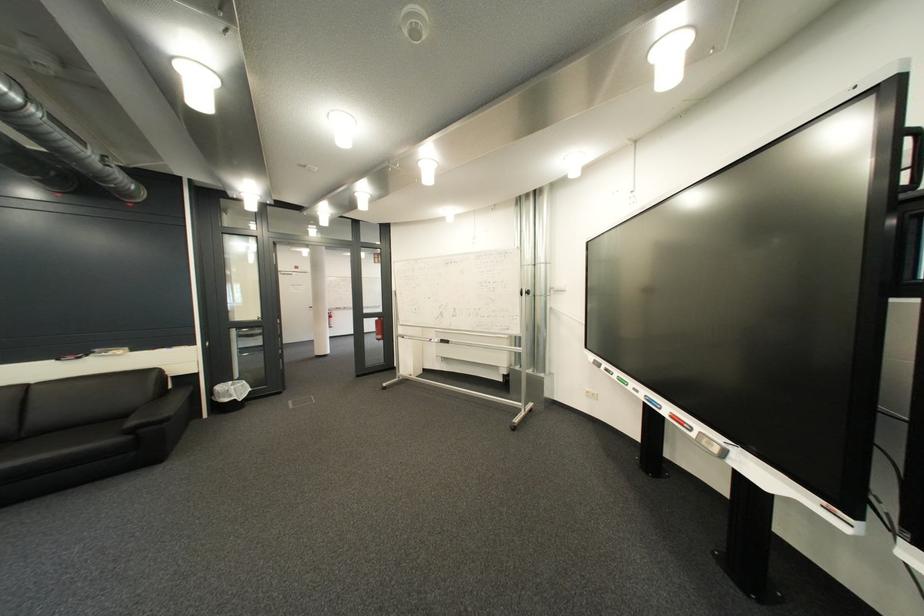
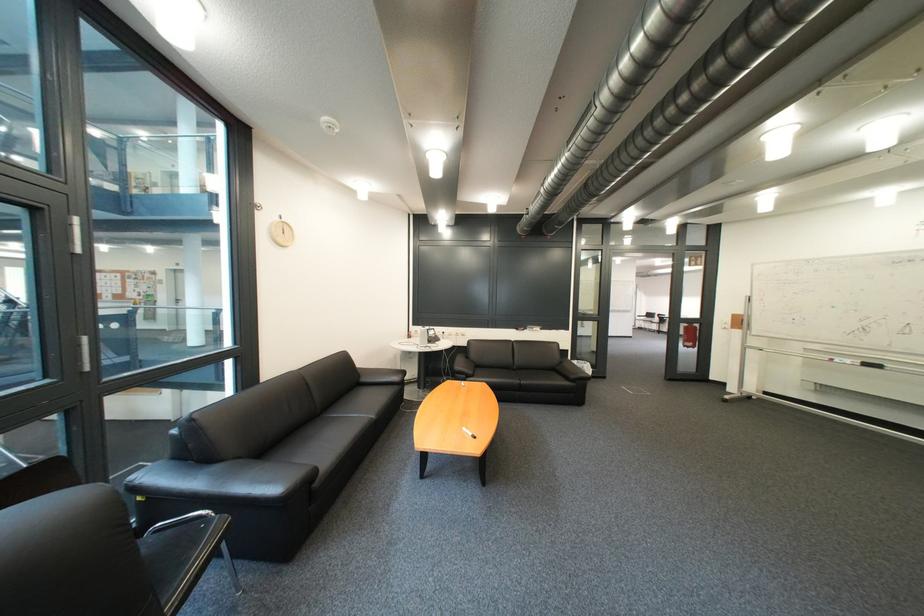
Where in the second image is the point corresponding to point 444,341 from the first image?

(845, 361)